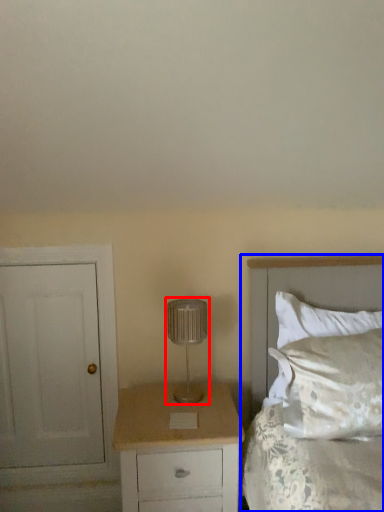
Question: Which point is further to the camera, lamp (highlighted by a red box) or bed (highlighted by a blue box)?

Choices:
 (A) lamp
 (B) bed

Answer: (A)